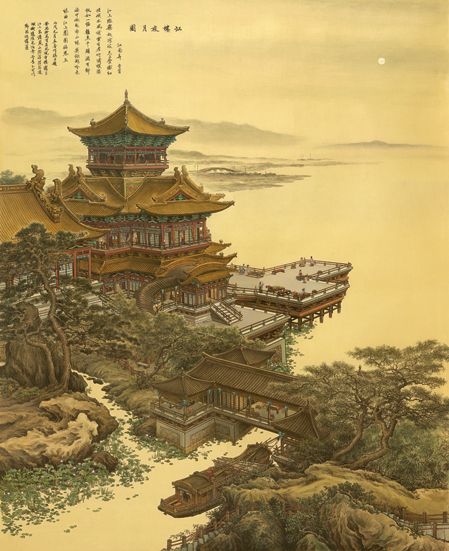
This screenshot has height=551, width=449. I want to click on painted stairs, so click(x=230, y=312), click(x=43, y=311).